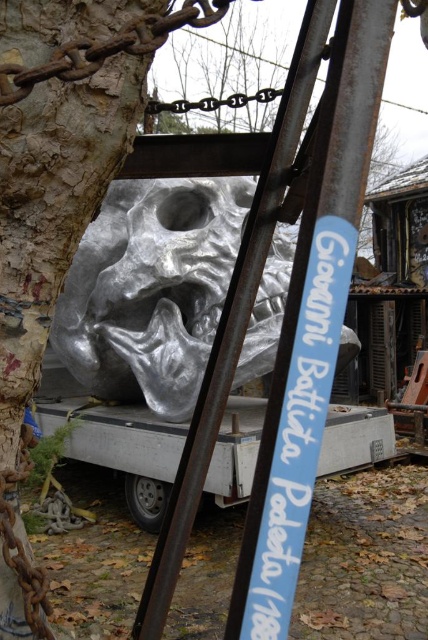
Who is positioned more to the left, rustic bark tree trunk at left or brushed metal tree at center?

rustic bark tree trunk at left is more to the left.

Does rustic bark tree trunk at left have a greater height compared to brushed metal tree at center?

In fact, rustic bark tree trunk at left may be shorter than brushed metal tree at center.

The width and height of the screenshot is (428, 640). I want to click on rustic bark tree trunk at left, so click(53, 209).

Which is above, shiny silver mask at center or rustic bark tree trunk at left?

shiny silver mask at center is higher up.

Locate an element on the screen. This screenshot has height=640, width=428. shiny silver mask at center is located at coordinates (151, 289).

Does point (210, 227) come in front of point (395, 150)?

Yes, point (210, 227) is in front of point (395, 150).

Is shiny silver mask at center closer to the viewer compared to brushed metal tree at center?

Yes, shiny silver mask at center is closer to the viewer.

The image size is (428, 640). In order to click on shiny silver mask at center in this screenshot , I will do `click(151, 289)`.